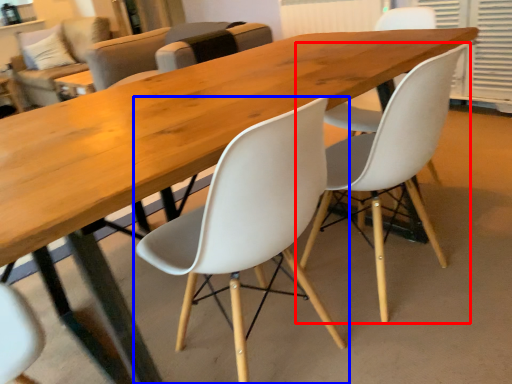
Question: Which point is closer to the camera, chair (highlighted by a red box) or chair (highlighted by a blue box)?

Choices:
 (A) chair
 (B) chair

Answer: (B)